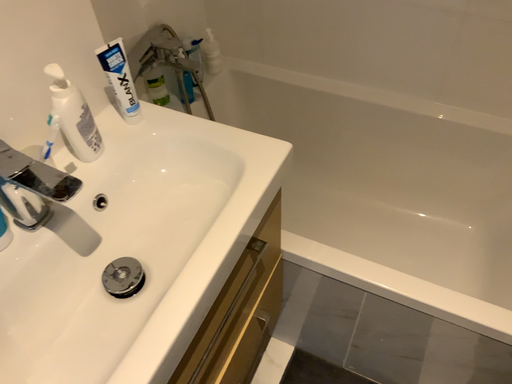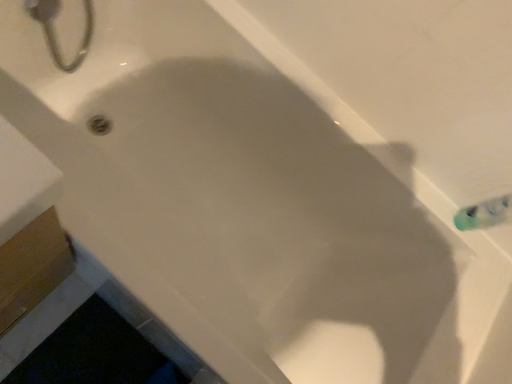
Question: How did the camera likely rotate when shooting the video?

Choices:
 (A) rotated left
 (B) rotated right

Answer: (B)